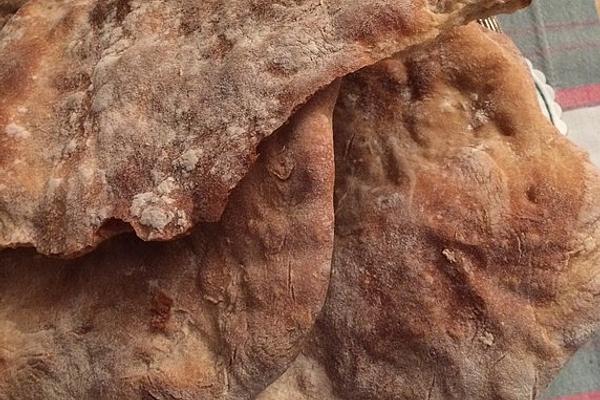
Where is `white ceramic plate`? The height and width of the screenshot is (400, 600). white ceramic plate is located at coordinates (542, 110).